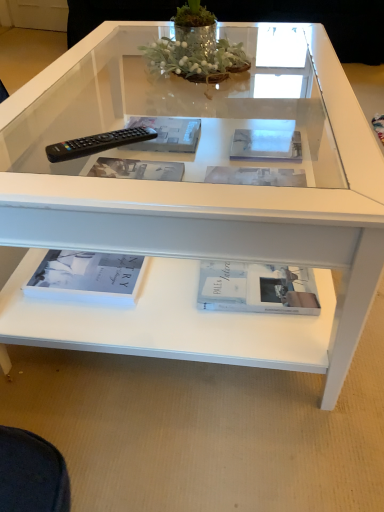
Identify the location of free point above white glossy magazine at center, which is counted as the first magazine, starting from the right (from a real-world perspective). (269, 142).